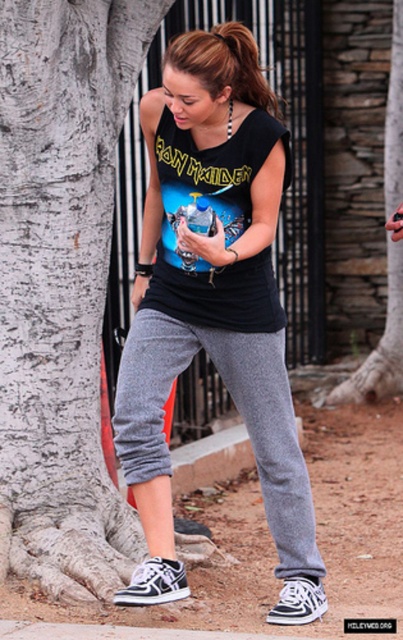
Based on the photo, you are a photographer trying to capture both the gray bark tree at left and the heathered gray sweatpants at lower center in a single shot. Given their sizes, which object will occupy more of the frame in your photo?

The gray bark tree at left is larger in size than the heathered gray sweatpants at lower center, so it will occupy more of the frame in the photo.

You are a photographer trying to capture a portrait of the person wearing the black cotton tank top at center. You want to include the gray bark tree at left in the background for context. Given the distance between them, can you frame both subjects in a single shot without moving either the person or the tree?

The distance between the gray bark tree at left and the black cotton tank top at center is 28.56 inches. Since this distance is relatively short, you can likely frame both subjects in a single shot by using a wide enough lens or adjusting your position to ensure both are within the camera frame.

Consider the image. You are a photographer standing at the position of the person in the image. You want to take a photo that includes both the gray bark tree trunk at right and the matte black tank top at center. What is the minimum distance you need to move backward to ensure both objects are fully visible in your camera frame?

The gray bark tree trunk at right is 6.45 meters away from the matte black tank top at center. To include both in the frame, you need to move backward until you can see both objects, but the exact distance depends on your camera lens and field of view. However, since the objects are 6.45 meters apart, moving back at least 6.45 meters from the tank top would ensure both are visible.